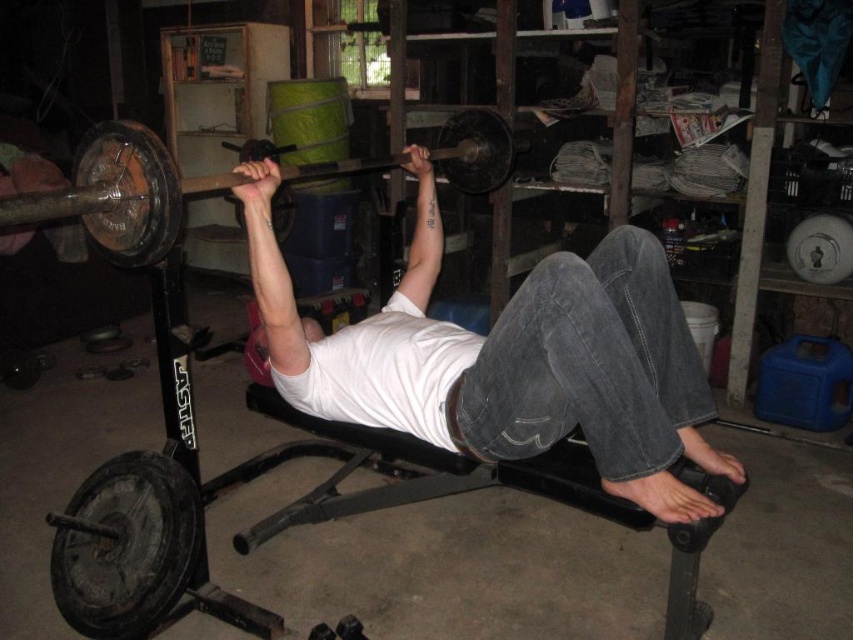
You are a fitness trainer observing someone doing bench press in a home gym. You notice the white matte shirt at center and the rusty metal barbell at center. Which object is positioned lower from the ground?

The white matte shirt at center is located below the rusty metal barbell at center, so the white matte shirt at center is positioned lower from the ground.

Consider the image. You are a personal trainer observing a client in a home gym. The client is wearing a white matte shirt at center and using a rusty metal barbell at center. Which object is closer to you, the trainer?

The white matte shirt at center is closer to you because it is further to the viewer than the rusty metal barbell at center.

You are a fitness trainer observing a client in a home gym. You notice the white matte shirt at center and the rusty metal barbell at center. Which object takes up more space in the image?

The white matte shirt at center is larger in size than the rusty metal barbell at center, so it takes up more space in the image.